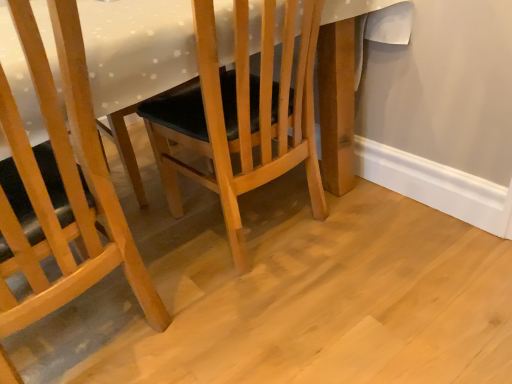
Where is `free location to the right of wooden chair at center, which is counted as the 2th chair, starting from the left`? The image size is (512, 384). free location to the right of wooden chair at center, which is counted as the 2th chair, starting from the left is located at coordinates (412, 238).